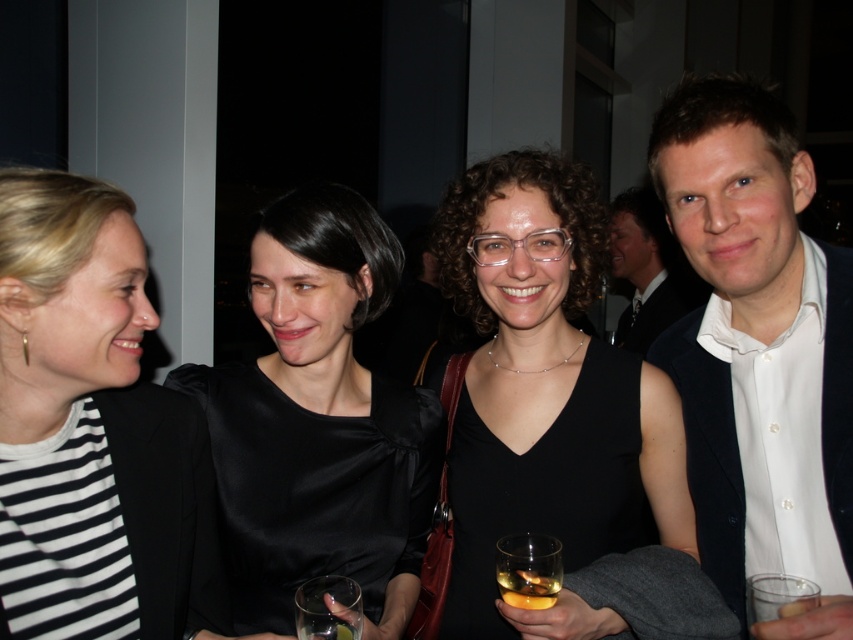
You are at a party and want to grab the transparent glass at lower center without moving the satin black dress at center. Is it possible?

The transparent glass at lower center is behind the satin black dress at center, so you can reach it without moving the dress by going around the sides or back of the dress.

Based on the coordinates provided, which object is located at point (x=318, y=422)?

The point (x=318, y=422) marks the location of the satin black dress at center.

You are at a social event and want to grab a drink. There are two translucent glasses in front of you. The first is the translucent glass at center, and the second is the translucent glass beverage at lower center. Which one should you reach for if you want the drink that is closer to you?

The translucent glass beverage at lower center is closer to you, so you should reach for it.